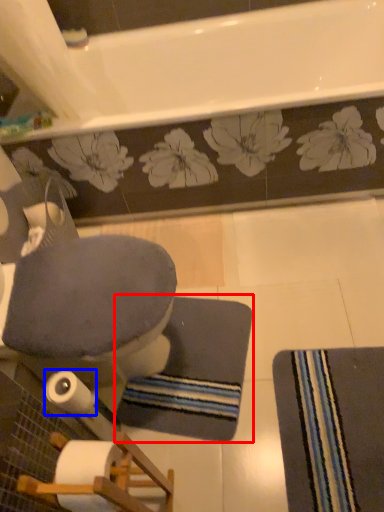
Question: Which of the following is the closest to the observer, bath mat (highlighted by a red box) or toilet paper (highlighted by a blue box)?

Choices:
 (A) bath mat
 (B) toilet paper

Answer: (B)